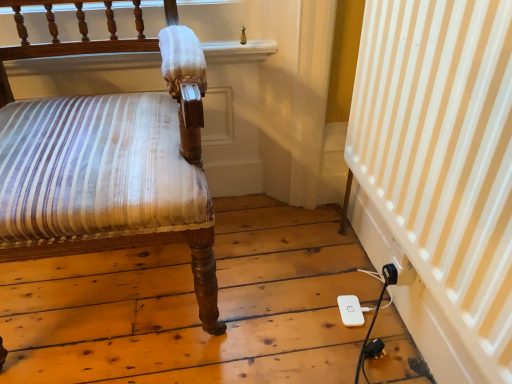
Question: From a real-world perspective, is white striped curtain at lower right positioned above or below matte brown wood chair at left?

Choices:
 (A) above
 (B) below

Answer: (B)

Question: Is white striped curtain at lower right wider or thinner than matte brown wood chair at left?

Choices:
 (A) thin
 (B) wide

Answer: (A)

Question: Based on their relative distances, which object is farther from the white plastic ipod at lower right?

Choices:
 (A) white striped curtain at lower right
 (B) matte brown wood chair at left

Answer: (B)

Question: Estimate the real-world distances between objects in this image. Which object is closer to the white striped curtain at lower right?

Choices:
 (A) matte brown wood chair at left
 (B) white plastic ipod at lower right

Answer: (B)